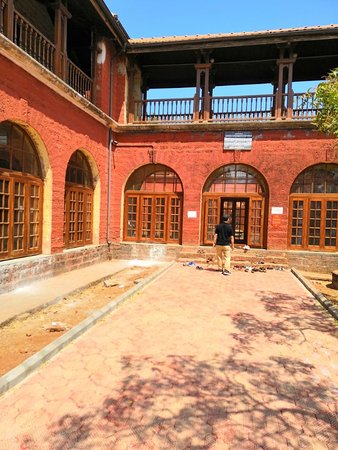
Identify the location of brown doors. This screenshot has height=450, width=338. (14, 226), (84, 215), (151, 214), (254, 219), (292, 219), (315, 219).